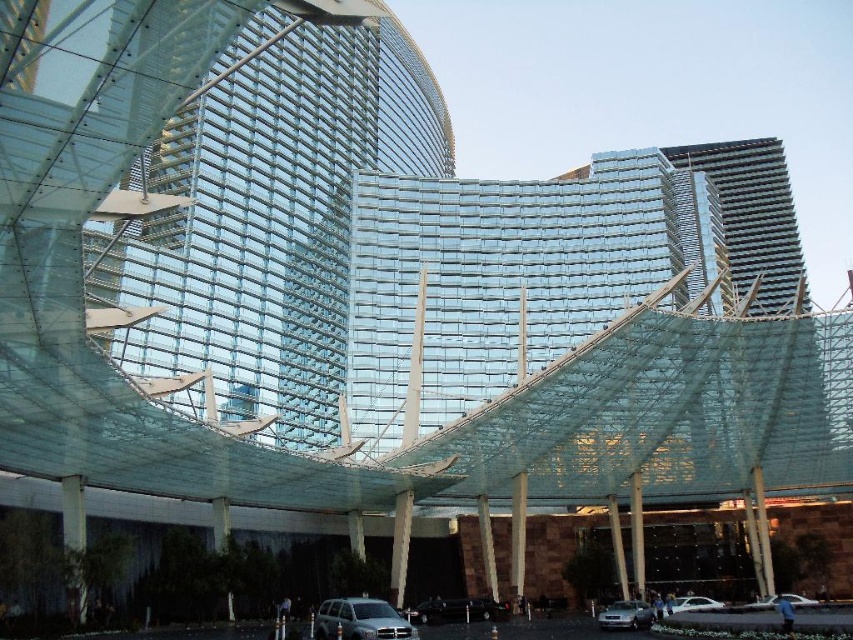
Question: Can you confirm if shiny black car at center is positioned below silver metallic car at lower center?

Choices:
 (A) no
 (B) yes

Answer: (B)

Question: Which point is closer to the camera taking this photo?

Choices:
 (A) (630, 627)
 (B) (428, 620)
 (C) (775, 604)

Answer: (A)

Question: Does silver metallic sedan at lower center have a greater width compared to white glossy car at lower center?

Choices:
 (A) yes
 (B) no

Answer: (B)

Question: Based on their relative distances, which object is nearer to the silver metallic sedan at lower center?

Choices:
 (A) white glossy car at lower center
 (B) silver metallic suv at lower center
 (C) silver metallic car at lower center

Answer: (A)

Question: Which point appears farthest from the camera in this image?

Choices:
 (A) click(x=421, y=618)
 (B) click(x=781, y=596)

Answer: (B)

Question: Can you confirm if shiny black car at center is wider than silver metallic car at lower center?

Choices:
 (A) no
 (B) yes

Answer: (A)